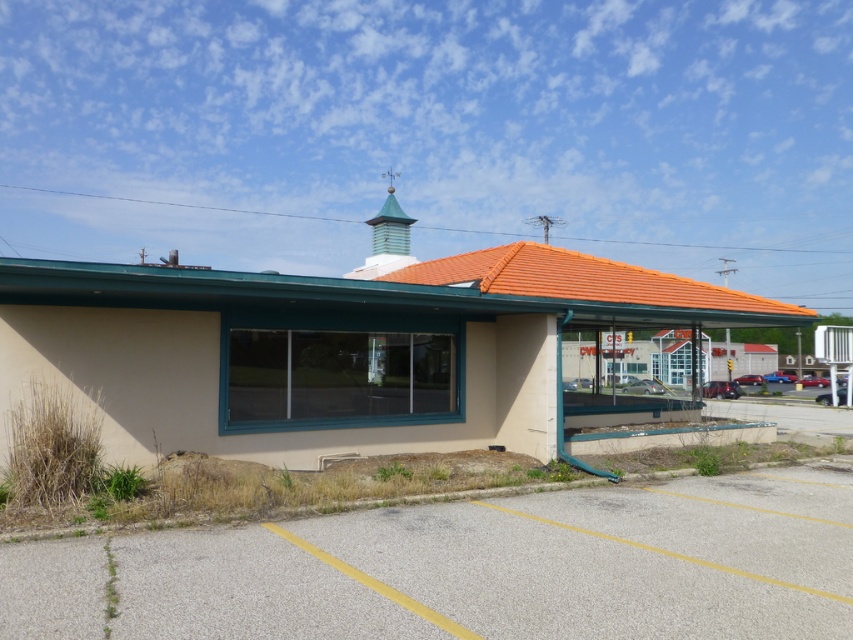
Is gray asphalt parking lot at lower left positioned before metallic silver sedan at center?

That is True.

Does gray asphalt parking lot at lower left have a lesser width compared to metallic silver sedan at center?

A: Yes, gray asphalt parking lot at lower left is thinner than metallic silver sedan at center.

Who is more forward, [601,568] or [627,387]?

Positioned in front is point [601,568].

At what (x,y) coordinates should I click in order to perform the action: click on gray asphalt parking lot at lower left. Please return your answer as a coordinate pair (x, y). The width and height of the screenshot is (853, 640). Looking at the image, I should click on (471, 568).

Identify the location of metallic red car at lower right. (721, 388).

Is metallic red car at lower right to the left of metallic silver sedan at center from the viewer's perspective?

Incorrect, metallic red car at lower right is not on the left side of metallic silver sedan at center.

Describe the element at coordinates (721, 388) in the screenshot. The width and height of the screenshot is (853, 640). I see `metallic red car at lower right` at that location.

This screenshot has width=853, height=640. Identify the location of metallic red car at lower right. (721, 388).

Can you confirm if beige matte building at center is positioned below gray asphalt parking lot at lower left?

No, beige matte building at center is not below gray asphalt parking lot at lower left.

Does beige matte building at center lie behind gray asphalt parking lot at lower left?

Yes, beige matte building at center is behind gray asphalt parking lot at lower left.

You are a GUI agent. You are given a task and a screenshot of the screen. Output one action in this format:
    pyautogui.click(x=<x>, y=<y>)
    Task: Click on the beige matte building at center
    
    Given the screenshot: What is the action you would take?
    pyautogui.click(x=355, y=348)